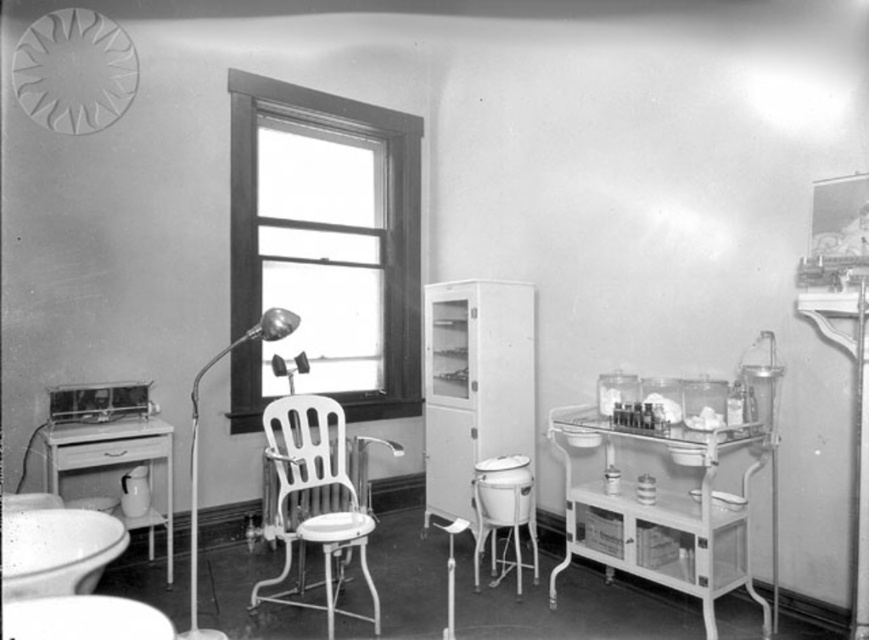
You are a patient sitting on the white metal chair with a high backrest and a footrest in the center of the room. You want to reach the point at coordinates point (513,433) and point (335,506). Which point is closer to your current position?

The point at coordinates point (335,506) is closer to your current position because it is in front of the point at coordinates point (513,433), which is behind it.